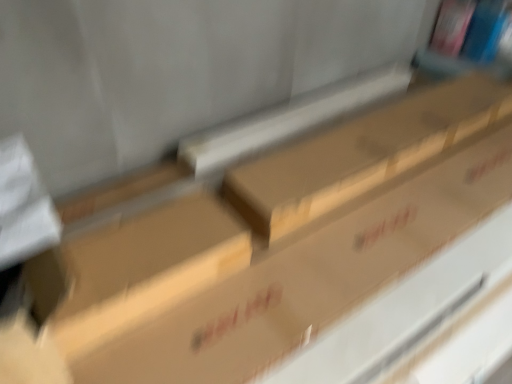
Where is `free space in front of brown cardboard box at center`? The width and height of the screenshot is (512, 384). free space in front of brown cardboard box at center is located at coordinates (381, 236).